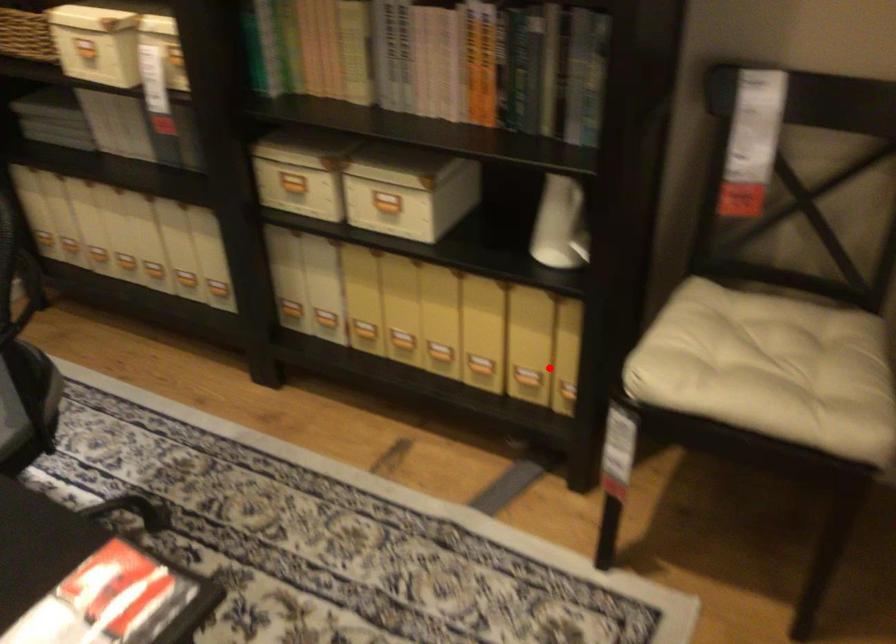
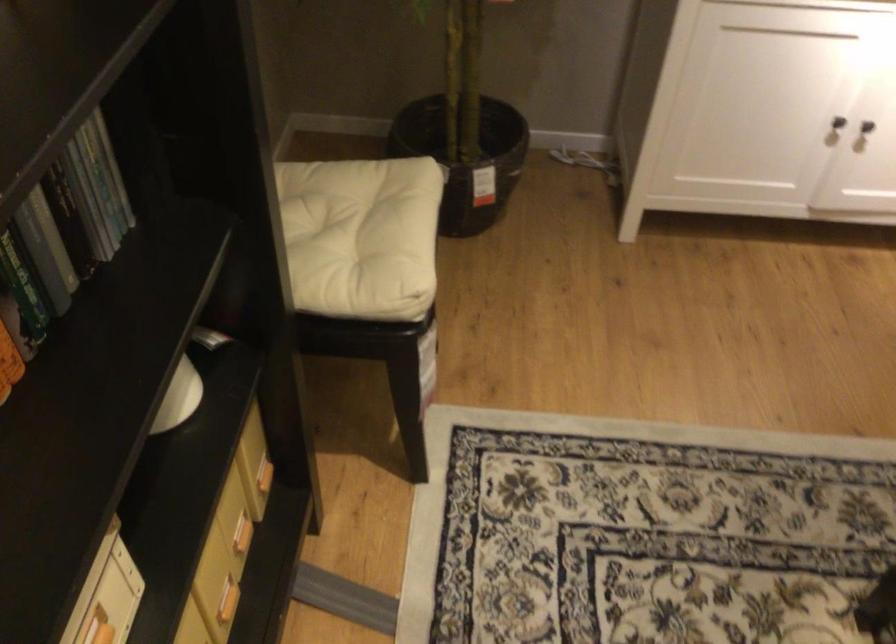
Question: I am providing you with two images of the same scene from different viewpoints. A red point is shown in image1. For the corresponding object point in image2, is it positioned nearer or farther from the camera?

Choices:
 (A) Nearer
 (B) Farther

Answer: (A)